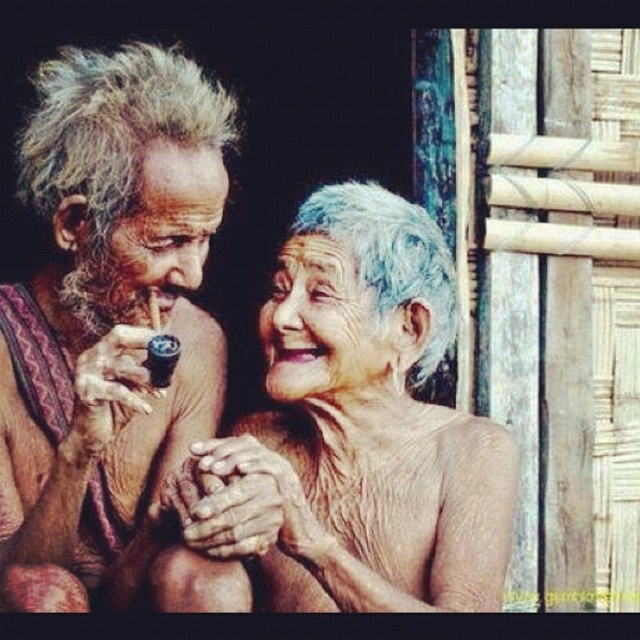
You are a photographer observing the scene. You need to adjust your camera to focus on both the brown textured cloth at left and the gray textured hair at center. Which object should you focus on first to ensure proper depth of field?

The brown textured cloth at left is taller than the gray textured hair at center, so you should focus on the brown textured cloth at left first to ensure proper depth of field.

You are an artist observing the scene. You need to paint the brown textured cloth at left and the gray textured hair at center. Which object should you paint first to ensure proper layering?

The brown textured cloth at left should be painted first because it is in front of the gray textured hair at center, ensuring the layers are correctly depicted.